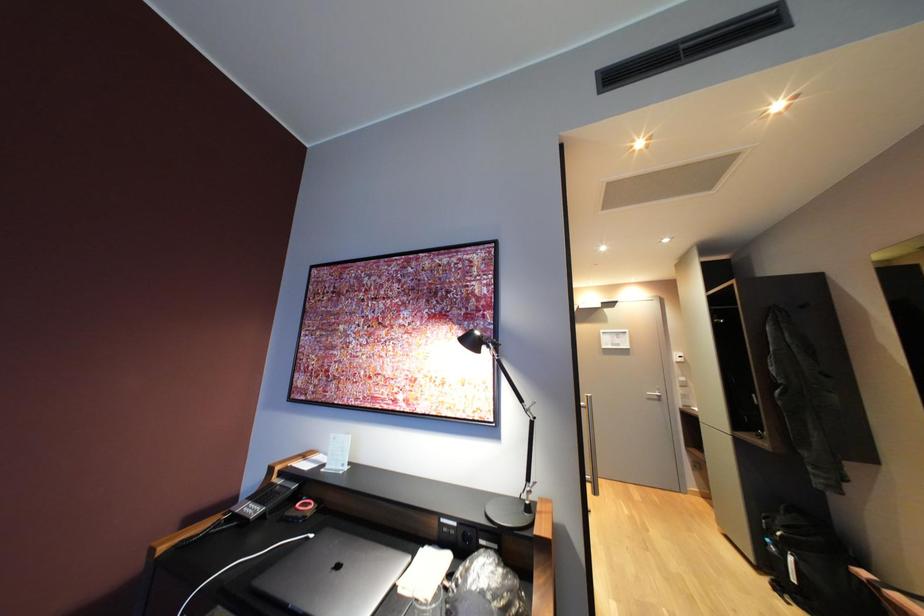
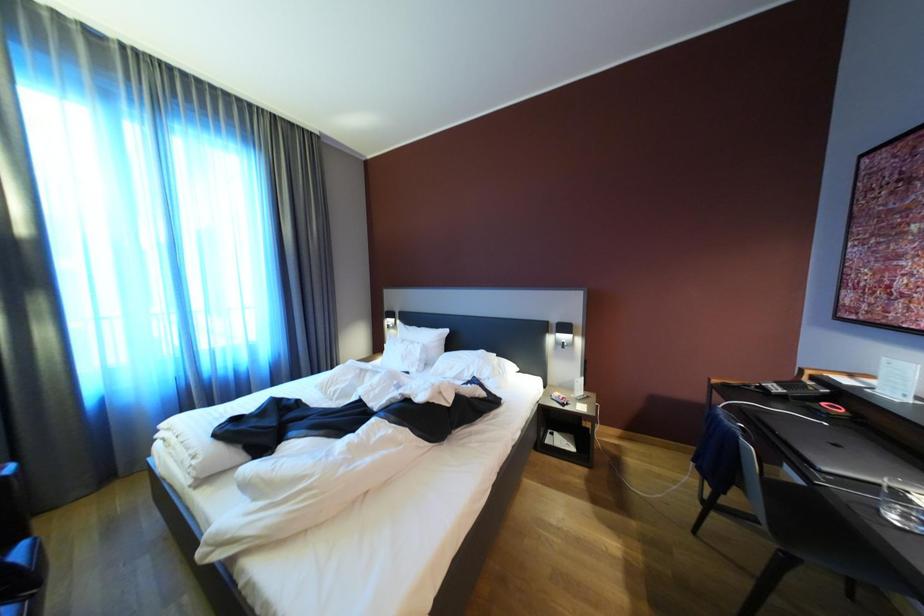
Question: How did the camera likely rotate?

Choices:
 (A) Left
 (B) Right
 (C) Up
 (D) Down

Answer: (A)